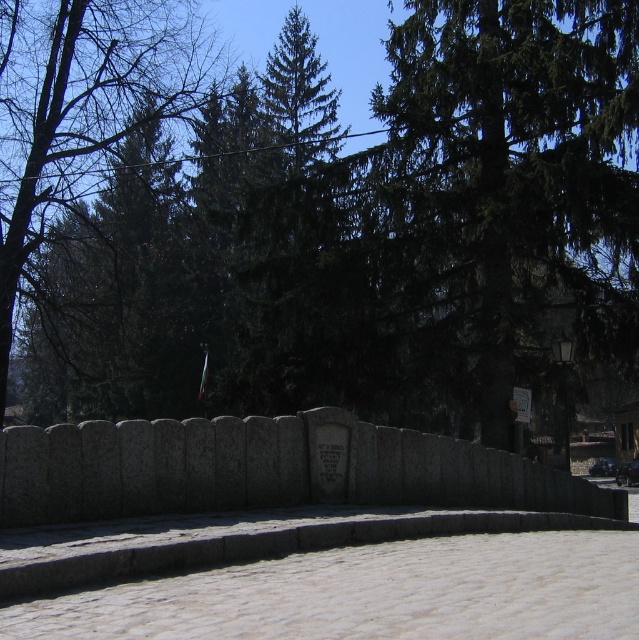
You are standing in the serene outdoor scene with the stone wall and coniferous trees. You notice two points marked in the image. The first point is at coordinates point (505, 387) and the second at point (17, 96). Which of these two points is closer to you, the observer?

Point (505, 387) is in front of point (17, 96), so it is closer to you.

You are a landscape architect designing a garden path that must pass between the dark green coniferous tree at center and the green leafy tree at upper left. Based on their widths, which tree would require more space on the path?

The green leafy tree at upper left requires more space on the path because its width is greater than that of the dark green coniferous tree at center.